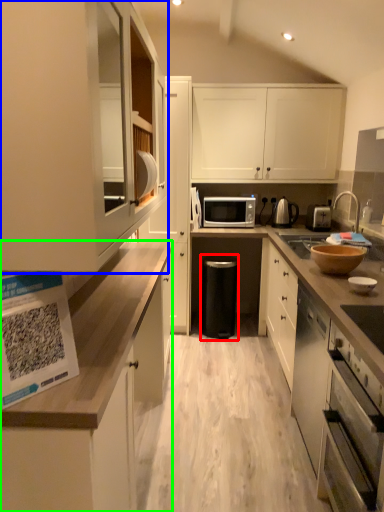
Question: Based on their relative distances, which object is nearer to dish washer (highlighted by a red box)? Choose from cabinetry (highlighted by a blue box) and cabinetry (highlighted by a green box).

Choices:
 (A) cabinetry
 (B) cabinetry

Answer: (B)